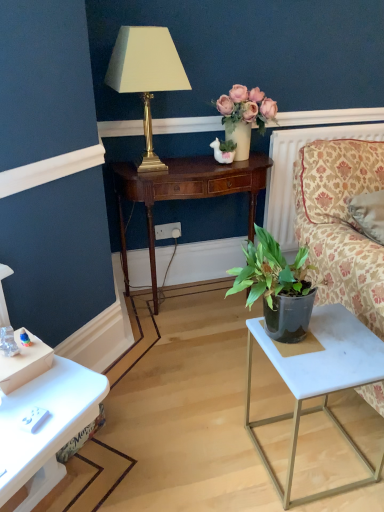
This screenshot has width=384, height=512. What do you see at coordinates (341, 224) in the screenshot?
I see `floral-patterned fabric couch at right` at bounding box center [341, 224].

Locate an element on the screen. This screenshot has height=512, width=384. matte gold lamp at upper center is located at coordinates point(146,75).

Measure the distance between point (x=374, y=127) and camera.

Point (x=374, y=127) and camera are 2.28 meters apart from each other.

In order to face white textured radiator at upper right, should I rotate leftwards or rightwards?

A 17.036 degree turn to the right will do.

Locate an element on the screen. mahogany wood table at center is located at coordinates (185, 192).

Locate an element on the screen. The width and height of the screenshot is (384, 512). matte cream vase at upper center is located at coordinates (245, 116).

Based on the photo, which is more to the right, white marble side table at lower right or white textured radiator at upper right?

From the viewer's perspective, white textured radiator at upper right appears more on the right side.

From a real-world perspective, is white marble side table at lower right physically located above or below white textured radiator at upper right?

From a real-world perspective, white marble side table at lower right is physically below white textured radiator at upper right.

Visually, is white textured radiator at upper right positioned to the left or to the right of matte gold lamp at upper center?

white textured radiator at upper right is to the right of matte gold lamp at upper center.

Considering the points (291, 216) and (137, 168), which point is in front, point (291, 216) or point (137, 168)?

Positioned in front is point (137, 168).

Considering the relative sizes of white textured radiator at upper right and matte gold lamp at upper center in the image provided, is white textured radiator at upper right taller than matte gold lamp at upper center?

Correct, white textured radiator at upper right is much taller as matte gold lamp at upper center.

From a real-world perspective, is white textured radiator at upper right above or below matte gold lamp at upper center?

white textured radiator at upper right is below matte gold lamp at upper center.

Can we say white marble side table at lower right lies outside mahogany wood table at center?

Yes, white marble side table at lower right is outside of mahogany wood table at center.

Measure the distance from white marble side table at lower right to mahogany wood table at center.

white marble side table at lower right is 36.52 inches away from mahogany wood table at center.

Between white marble side table at lower right and mahogany wood table at center, which one has smaller size?

With smaller size is white marble side table at lower right.

Considering the sizes of white marble side table at lower right and mahogany wood table at center in the image, is white marble side table at lower right wider or thinner than mahogany wood table at center?

Clearly, white marble side table at lower right has more width compared to mahogany wood table at center.

Consider the image. Can you confirm if white textured radiator at upper right is taller than matte cream vase at upper center?

Yes, white textured radiator at upper right is taller than matte cream vase at upper center.

Considering the points (290, 186) and (228, 122), which point is in front, point (290, 186) or point (228, 122)?

The point (228, 122) is in front.

Is white textured radiator at upper right surrounding matte cream vase at upper center?

Definitely not — matte cream vase at upper center is not inside white textured radiator at upper right.

Considering the positions of objects white textured radiator at upper right and matte cream vase at upper center in the image provided, who is in front, white textured radiator at upper right or matte cream vase at upper center?

matte cream vase at upper center is more forward.

Which object is positioned more to the right, matte gold lamp at upper center or white plastic power outlet at center?

white plastic power outlet at center.

How many degrees apart are the facing directions of matte gold lamp at upper center and white plastic power outlet at center?

There is a 0.247-degree angle between the facing directions of matte gold lamp at upper center and white plastic power outlet at center.

Between point (172, 86) and point (164, 228), which one is positioned behind?

Positioned behind is point (164, 228).

Looking at this image, considering the relative sizes of matte gold lamp at upper center and white plastic power outlet at center in the image provided, is matte gold lamp at upper center taller than white plastic power outlet at center?

Yes, matte gold lamp at upper center is taller than white plastic power outlet at center.

Considering the positions of objects mahogany wood table at center and white textured radiator at upper right in the image provided, who is behind, mahogany wood table at center or white textured radiator at upper right?

Positioned behind is white textured radiator at upper right.

From the image's perspective, would you say mahogany wood table at center is positioned over white textured radiator at upper right?

No, from the image's perspective, mahogany wood table at center is not above white textured radiator at upper right.

Considering the points (154, 190) and (291, 188), which point is behind, point (154, 190) or point (291, 188)?

Positioned behind is point (291, 188).

Can you see white textured radiator at upper right touching white plastic power outlet at center?

No.

Relative to white plastic power outlet at center, is white textured radiator at upper right in front or behind?

white textured radiator at upper right is positioned closer to the viewer than white plastic power outlet at center.

Can you confirm if white textured radiator at upper right is bigger than white plastic power outlet at center?

Correct, white textured radiator at upper right is larger in size than white plastic power outlet at center.

Where is `table located in front of the white textured radiator at upper right`? The width and height of the screenshot is (384, 512). table located in front of the white textured radiator at upper right is located at coordinates (318, 380).

Identify the location of radiator below the matte gold lamp at upper center (from the image's perspective). (292, 172).

Considering their positions, is white textured radiator at upper right positioned further to matte gold lamp at upper center than mahogany wood table at center?

white textured radiator at upper right lies further to matte gold lamp at upper center than the other object.

Estimate the real-world distances between objects in this image. Which object is closer to white plastic power outlet at center, white marble side table at lower right or mahogany wood table at center?

Among the two, mahogany wood table at center is located nearer to white plastic power outlet at center.

From the image, which object appears to be farther from matte cream vase at upper center, mahogany wood table at center or matte gold lamp at upper center?

The object further to matte cream vase at upper center is matte gold lamp at upper center.

From the image, which object appears to be nearer to white textured radiator at upper right, matte cream vase at upper center or white marble side table at lower right?

Among the two, matte cream vase at upper center is located nearer to white textured radiator at upper right.

Which object lies nearer to the anchor point white textured radiator at upper right, white plastic power outlet at center or white marble side table at lower right?

The object closer to white textured radiator at upper right is white plastic power outlet at center.

From the image, which object appears to be nearer to floral-patterned fabric couch at right, white marble side table at lower right or mahogany wood table at center?

white marble side table at lower right lies closer to floral-patterned fabric couch at right than the other object.

When comparing their distances from white plastic power outlet at center, does white textured radiator at upper right or mahogany wood table at center seem closer?

mahogany wood table at center is positioned closer to the anchor white plastic power outlet at center.

When comparing their distances from floral-patterned fabric couch at right, does white textured radiator at upper right or white plastic power outlet at center seem further?

white plastic power outlet at center is positioned further to the anchor floral-patterned fabric couch at right.

Where is `nightstand between matte gold lamp at upper center and white textured radiator at upper right from left to right`? This screenshot has width=384, height=512. nightstand between matte gold lamp at upper center and white textured radiator at upper right from left to right is located at coordinates (185, 192).

This screenshot has height=512, width=384. I want to click on studio couch between matte gold lamp at upper center and white marble side table at lower right in the up-down direction, so click(x=341, y=224).

This screenshot has height=512, width=384. Find the location of `floral arrangement between white marble side table at lower right and white textured radiator at upper right in the front-back direction`. floral arrangement between white marble side table at lower right and white textured radiator at upper right in the front-back direction is located at coordinates (245, 116).

You are a GUI agent. You are given a task and a screenshot of the screen. Output one action in this format:
    pyautogui.click(x=<x>, y=<y>)
    Task: Click on the floral arrangement between matte gold lamp at upper center and white textured radiator at upper right from left to right
    This screenshot has width=384, height=512.
    Given the screenshot: What is the action you would take?
    pyautogui.click(x=245, y=116)